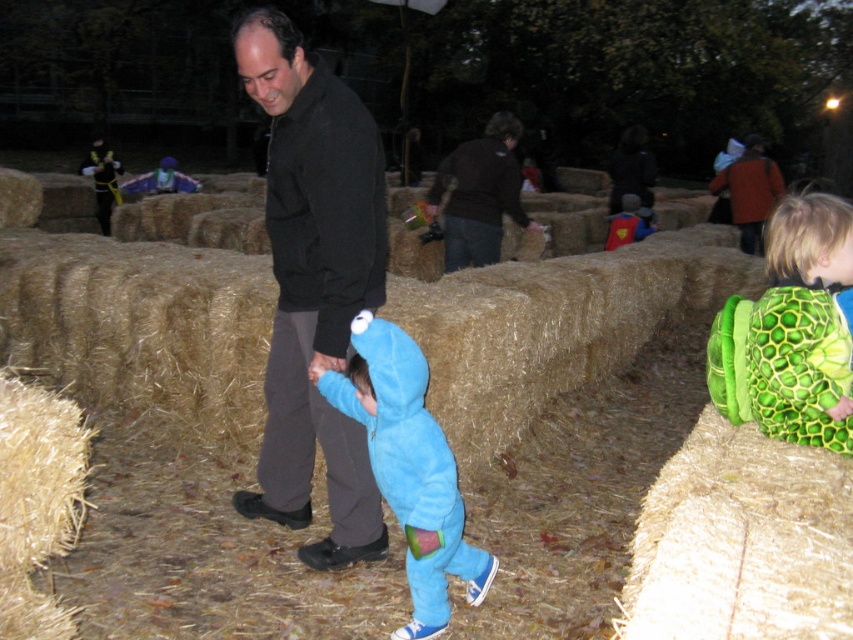
You are a participant in the hay maze event and need to carry your belongings. You have a green textured backpack at right and a dark brown leather jacket at upper center. Which item has a smaller width that might be easier to carry through narrow maze paths?

The green textured backpack at right has a lesser width compared to the dark brown leather jacket at upper center, so it would be easier to carry through narrow maze paths.

You are a participant in the hay maze and need to retrieve an item. You see the green textured backpack at right and the dark brown leather jacket at upper center. Which item is positioned lower in the scene?

The green textured backpack at right is located below the dark brown leather jacket at upper center, so it is positioned lower in the scene.